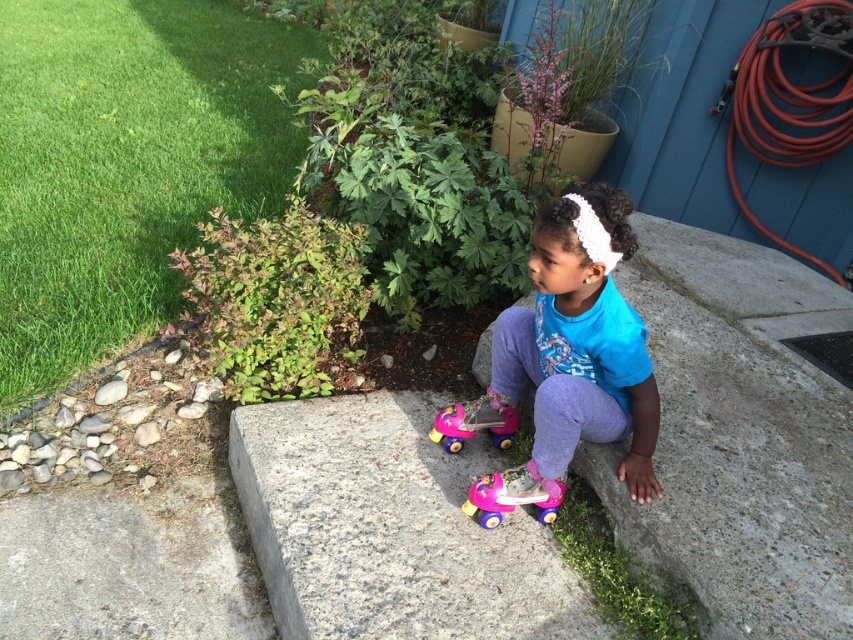
Between point (509, 588) and point (527, 317), which one is positioned behind?

Positioned behind is point (527, 317).

Locate an element on the screen. Image resolution: width=853 pixels, height=640 pixels. gray granite concrete at center is located at coordinates (390, 529).

Does gray granite concrete at center appear under pink plastic toy at center?

Yes, gray granite concrete at center is below pink plastic toy at center.

Describe the element at coordinates (390, 529) in the screenshot. I see `gray granite concrete at center` at that location.

What do you see at coordinates (390, 529) in the screenshot?
I see `gray granite concrete at center` at bounding box center [390, 529].

Find the location of a particular element. gray granite concrete at center is located at coordinates (390, 529).

Which is in front, point (553, 600) or point (485, 528)?

Positioned in front is point (553, 600).

From the picture: Can you confirm if gray granite concrete at center is positioned above pink plastic walker at lower center?

No.

Does point (328, 595) come closer to viewer compared to point (503, 483)?

Yes.

Locate an element on the screen. The image size is (853, 640). gray granite concrete at center is located at coordinates (390, 529).